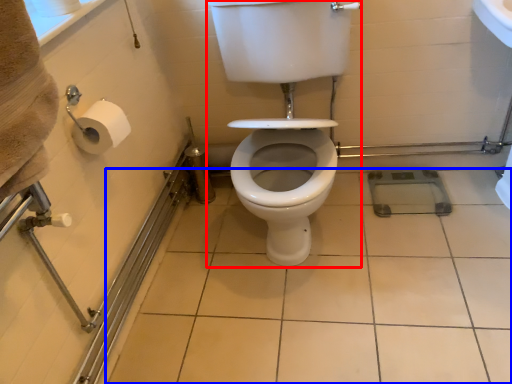
Question: Which object appears closest to the camera in this image, sit (highlighted by a red box) or ceramic tile (highlighted by a blue box)?

Choices:
 (A) sit
 (B) ceramic tile

Answer: (A)